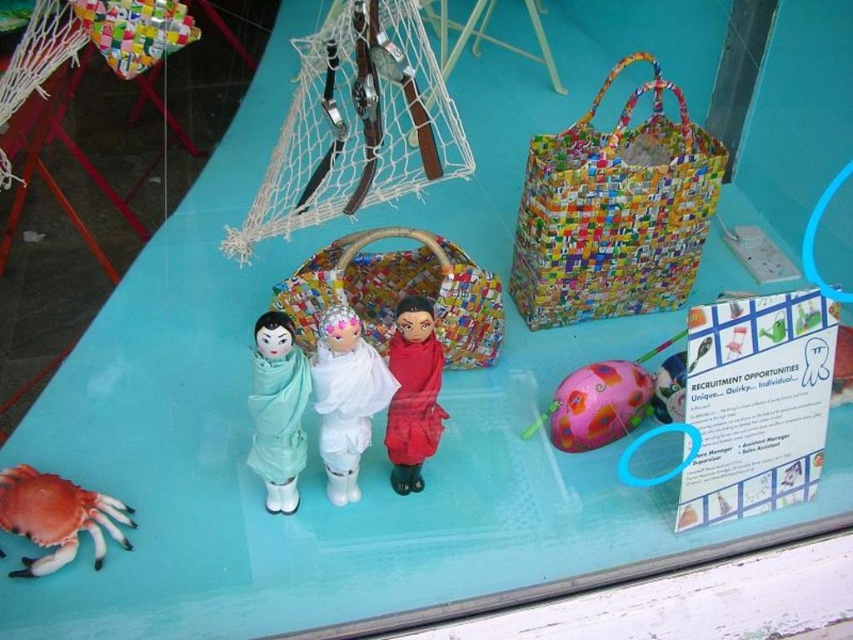
Question: Is white glossy doll at center further to camera compared to red plastic crab at lower left?

Choices:
 (A) yes
 (B) no

Answer: (A)

Question: Can you confirm if white glossy doll at center is positioned below red plastic crab at lower left?

Choices:
 (A) yes
 (B) no

Answer: (B)

Question: Among these points, which one is nearest to the camera?

Choices:
 (A) (277, 376)
 (B) (129, 541)

Answer: (A)

Question: Which point appears farthest from the camera in this image?

Choices:
 (A) (360, 394)
 (B) (74, 515)

Answer: (A)

Question: Does white glossy doll at center appear on the left side of red plastic crab at lower left?

Choices:
 (A) no
 (B) yes

Answer: (A)

Question: Which object is positioned closest to the red plastic crab at lower left?

Choices:
 (A) matte green fabric doll at center
 (B) white glossy doll at center

Answer: (A)